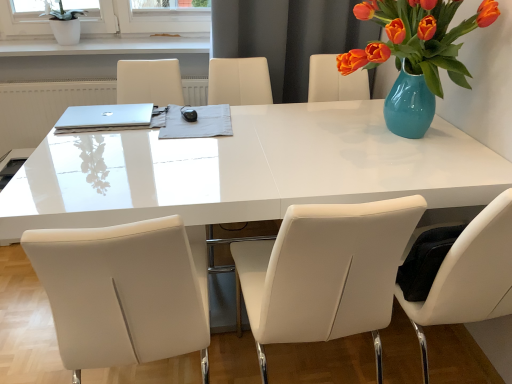
Question: From the image's perspective, is white glossy table at center positioned above or below silver metallic laptop at upper left?

Choices:
 (A) above
 (B) below

Answer: (B)

Question: Based on their sizes in the image, would you say white glossy table at center is bigger or smaller than silver metallic laptop at upper left?

Choices:
 (A) small
 (B) big

Answer: (B)

Question: Which object is the farthest from the silver metallic laptop at upper left?

Choices:
 (A) white glossy table at center
 (B) white ceramic pot at upper left
 (C) turquoise ceramic vase at upper right
 (D) white leather chair at center, the second chair from the left
 (E) white leather chair at center, the second chair positioned from the right

Answer: (C)

Question: Based on their relative distances, which object is nearer to the turquoise ceramic vase at upper right?

Choices:
 (A) white glossy table at center
 (B) white leather chair at center, the second chair positioned from the right
 (C) silver metallic laptop at upper left
 (D) white leather chair at center, placed as the first chair when sorted from right to left
 (E) white ceramic pot at upper left

Answer: (A)